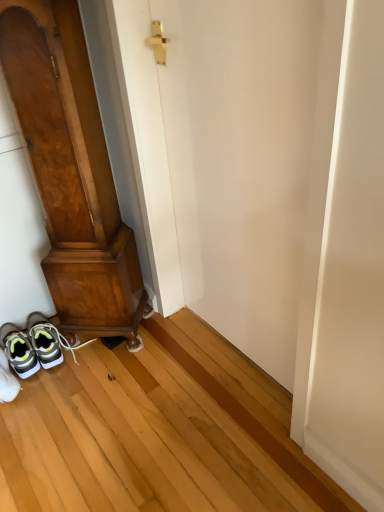
Where is `vacant area that lies in front of white matte sneakers at lower left, which ranks as the 2th footwear in front-to-back order`? The height and width of the screenshot is (512, 384). vacant area that lies in front of white matte sneakers at lower left, which ranks as the 2th footwear in front-to-back order is located at coordinates pos(42,402).